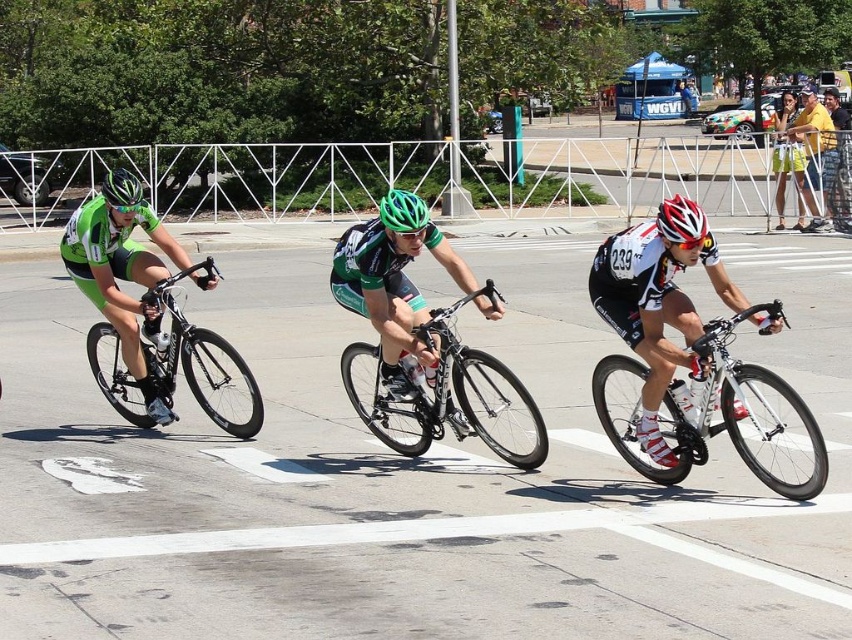
Can you confirm if yellow cotton shirt at upper right is wider than white matte bicycle helmet at center?

Indeed, yellow cotton shirt at upper right has a greater width compared to white matte bicycle helmet at center.

Does yellow cotton shirt at upper right appear over white matte bicycle helmet at center?

Yes, yellow cotton shirt at upper right is above white matte bicycle helmet at center.

Is point (822, 132) less distant than point (657, 212)?

No, it is behind (657, 212).

I want to click on yellow cotton shirt at upper right, so click(x=812, y=150).

Identify the location of green fabric jersey at left. The image size is (852, 640). (122, 280).

What do you see at coordinates (122, 280) in the screenshot? The image size is (852, 640). I see `green fabric jersey at left` at bounding box center [122, 280].

Locate an element on the screen. green fabric jersey at left is located at coordinates (122, 280).

Between shiny black bicycle at center and shiny black bicycle at left, which one has more height?

shiny black bicycle at left

Is point (502, 458) less distant than point (170, 333)?

Yes, point (502, 458) is closer to viewer.

At what (x,y) coordinates should I click in order to perform the action: click on shiny black bicycle at center. Please return your answer as a coordinate pair (x, y). The image size is (852, 640). Looking at the image, I should click on (447, 392).